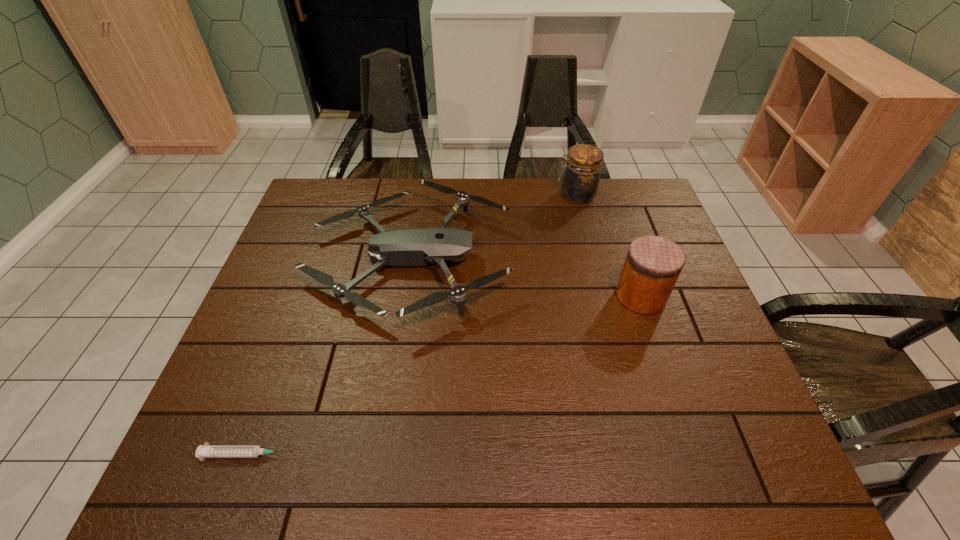
Locate an element on the screen. The height and width of the screenshot is (540, 960). the farther jar is located at coordinates (580, 182).

Image resolution: width=960 pixels, height=540 pixels. I want to click on the nearer jar, so click(653, 264).

Where is `drone`? The image size is (960, 540). drone is located at coordinates (405, 247).

Where is `the nearest object`? Image resolution: width=960 pixels, height=540 pixels. the nearest object is located at coordinates (204, 451).

At what (x,y) coordinates should I click in order to perform the action: click on syringe. Please return your answer as a coordinate pair (x, y). Looking at the image, I should click on click(x=204, y=451).

Where is `vacant space located 0.240m on the lid of the farther jar`? The image size is (960, 540). vacant space located 0.240m on the lid of the farther jar is located at coordinates (484, 195).

Find the location of `free point located on the lid of the farther jar`. free point located on the lid of the farther jar is located at coordinates (454, 195).

This screenshot has height=540, width=960. I want to click on blank space located 0.370m on the lid of the farther jar, so click(444, 195).

Where is `vacant region located on the left of the nearer jar`? vacant region located on the left of the nearer jar is located at coordinates (532, 296).

Identify the location of vacant space located 0.170m with a camera mounted on the front of the second shortest object. This screenshot has height=540, width=960. (570, 259).